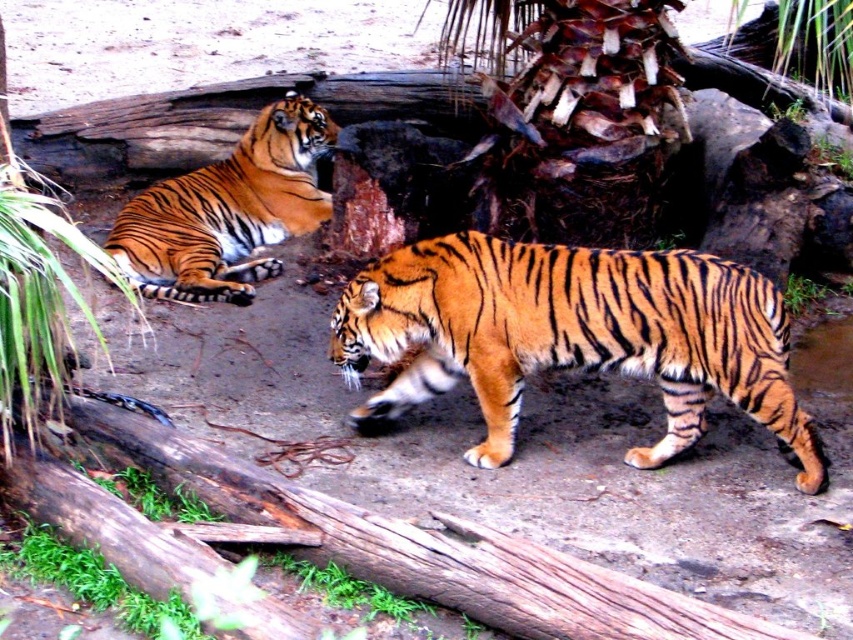
Can you confirm if orange striped tiger at center is smaller than orange striped tiger at upper left?

No.

Does orange striped tiger at center come in front of orange striped tiger at upper left?

That is True.

The height and width of the screenshot is (640, 853). Identify the location of orange striped tiger at center. (573, 336).

Image resolution: width=853 pixels, height=640 pixels. I want to click on orange striped tiger at center, so click(573, 336).